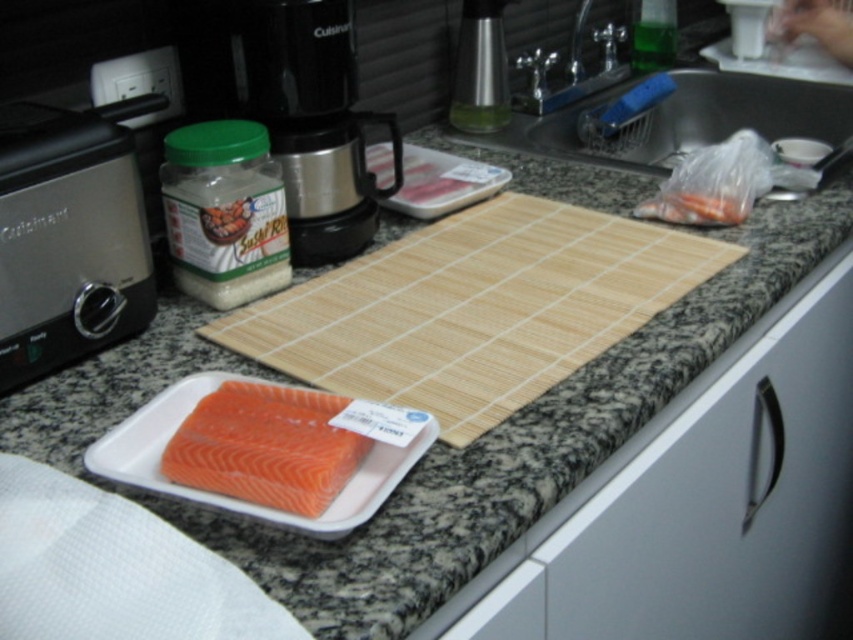
Is white matte drawer at lower right thinner than pink fleshed salmon at center?

In fact, white matte drawer at lower right might be wider than pink fleshed salmon at center.

Which is more to the left, white matte drawer at lower right or pink fleshed salmon at center?

pink fleshed salmon at center is more to the left.

Locate an element on the screen. Image resolution: width=853 pixels, height=640 pixels. white matte drawer at lower right is located at coordinates (728, 502).

Does satin silver toaster at left have a larger size compared to pink fleshed salmon at center?

Yes, satin silver toaster at left is bigger than pink fleshed salmon at center.

How far apart are satin silver toaster at left and pink fleshed salmon at center?

The distance of satin silver toaster at left from pink fleshed salmon at center is 8.91 inches.

Who is more distant from viewer, (62, 280) or (235, 458)?

The point (62, 280) is more distant.

The height and width of the screenshot is (640, 853). I want to click on satin silver toaster at left, so coord(68,236).

The height and width of the screenshot is (640, 853). What do you see at coordinates (728, 502) in the screenshot?
I see `white matte drawer at lower right` at bounding box center [728, 502].

Does white matte drawer at lower right have a lesser width compared to translucent plastic carrots at upper right?

No, white matte drawer at lower right is not thinner than translucent plastic carrots at upper right.

Is point (833, 576) in front of point (706, 209)?

No, it is behind (706, 209).

Image resolution: width=853 pixels, height=640 pixels. In order to click on white matte drawer at lower right in this screenshot , I will do pyautogui.click(x=728, y=502).